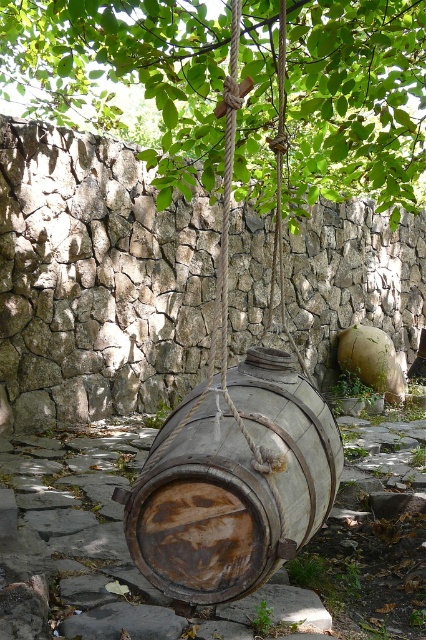
Which is more to the right, green leafy tree at upper center or rusty wood barrel at center?

From the viewer's perspective, rusty wood barrel at center appears more on the right side.

Does green leafy tree at upper center appear under rusty wood barrel at center?

Actually, green leafy tree at upper center is above rusty wood barrel at center.

You are a GUI agent. You are given a task and a screenshot of the screen. Output one action in this format:
    pyautogui.click(x=<x>, y=<y>)
    Task: Click on the green leafy tree at upper center
    
    Given the screenshot: What is the action you would take?
    pyautogui.click(x=123, y=74)